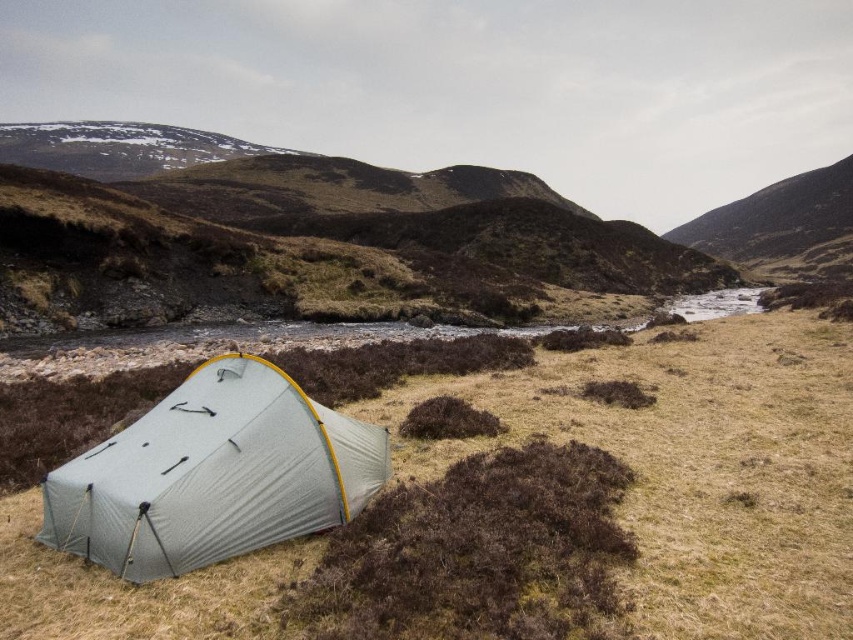
Between point (281, 195) and point (253, 362), which one is positioned in front?

Positioned in front is point (253, 362).

Does brown grassy hillside at center have a larger size compared to gray fabric tent at lower left?

Correct, brown grassy hillside at center is larger in size than gray fabric tent at lower left.

Is point (212, 243) behind point (285, 426)?

Yes, it is behind point (285, 426).

Locate an element on the screen. brown grassy hillside at center is located at coordinates (312, 246).

Is green fabric tent at lower left to the right of gray fabric tent at lower left from the viewer's perspective?

Yes, green fabric tent at lower left is to the right of gray fabric tent at lower left.

Who is shorter, green fabric tent at lower left or gray fabric tent at lower left?

gray fabric tent at lower left is shorter.

Which is in front, point (811, 493) or point (61, 548)?

Point (61, 548) is in front.

Locate an element on the screen. green fabric tent at lower left is located at coordinates (698, 467).

Which of these two, green fabric tent at lower left or brown grassy hillside at center, stands shorter?

green fabric tent at lower left

Which is above, green fabric tent at lower left or brown grassy hillside at center?

brown grassy hillside at center is above.

Who is more distant from viewer, (141, 588) or (206, 284)?

Positioned behind is point (206, 284).

Where is `green fabric tent at lower left`? green fabric tent at lower left is located at coordinates (698, 467).